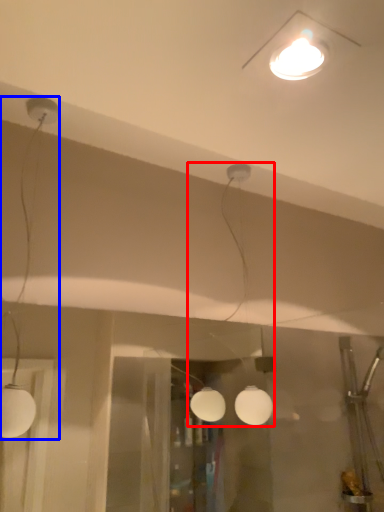
Question: Which of the following is the closest to the observer, lamp (highlighted by a red box) or lamp (highlighted by a blue box)?

Choices:
 (A) lamp
 (B) lamp

Answer: (B)